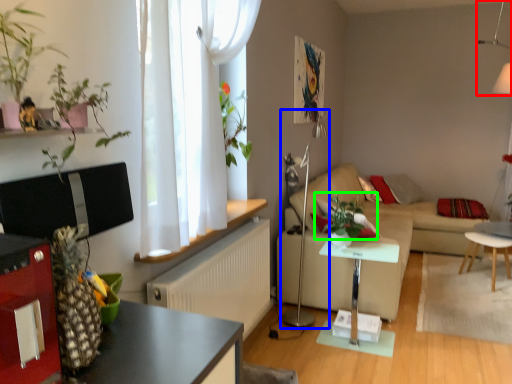
Question: Which object is the farthest from lamp (highlighted by a red box)? Choose among these: lamp (highlighted by a blue box) or plant (highlighted by a green box).

Choices:
 (A) lamp
 (B) plant

Answer: (A)